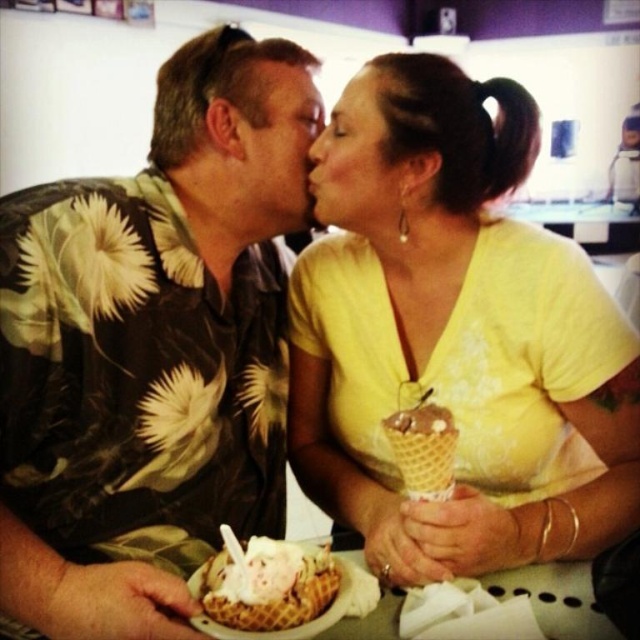
Does yellow matte shirt at center appear on the left side of soft pink ice cream at center?

No, yellow matte shirt at center is not to the left of soft pink ice cream at center.

Which of these two, yellow matte shirt at center or soft pink ice cream at center, stands shorter?

With less height is soft pink ice cream at center.

Who is more forward, (445, 96) or (298, 563)?

Positioned in front is point (298, 563).

This screenshot has height=640, width=640. I want to click on yellow matte shirt at center, so click(x=452, y=336).

Does floral-patterned shirt at left lie in front of matte yellow shirt at center?

Yes, it is in front of matte yellow shirt at center.

This screenshot has width=640, height=640. What are the coordinates of `floral-patterned shirt at left` in the screenshot? It's located at (147, 356).

Identify the location of floral-patterned shirt at left. This screenshot has height=640, width=640. (147, 356).

Who is shorter, floral-patterned shirt at left or matte skin forehead at center?

matte skin forehead at center

Can you confirm if floral-patterned shirt at left is positioned to the right of matte skin forehead at center?

Incorrect, floral-patterned shirt at left is not on the right side of matte skin forehead at center.

Is point (163, 122) farther from camera compared to point (307, 74)?

No.

Locate an element on the screen. Image resolution: width=640 pixels, height=640 pixels. floral-patterned shirt at left is located at coordinates (147, 356).